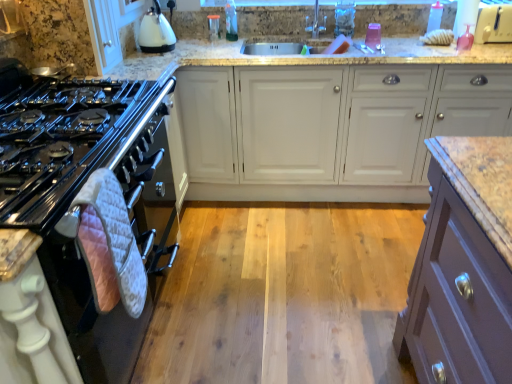
Question: Can you confirm if white quilted oven mitt at left is bigger than white matte cabinet at center?

Choices:
 (A) yes
 (B) no

Answer: (B)

Question: From the image's perspective, is white quilted oven mitt at left under white matte cabinet at center?

Choices:
 (A) no
 (B) yes

Answer: (B)

Question: Is white matte cabinet at center surrounded by white quilted oven mitt at left?

Choices:
 (A) no
 (B) yes

Answer: (A)

Question: Is white quilted oven mitt at left placed right next to white matte cabinet at center?

Choices:
 (A) yes
 (B) no

Answer: (B)

Question: Can we say white quilted oven mitt at left lies outside white matte cabinet at center?

Choices:
 (A) no
 (B) yes

Answer: (B)

Question: Is white quilted oven mitt at left further to the viewer compared to white matte cabinet at center?

Choices:
 (A) no
 (B) yes

Answer: (A)

Question: Considering the relative sizes of transparent plastic bottle at upper right, the first bottle positioned from the right, and black glossy gas stove at left in the image provided, is transparent plastic bottle at upper right, the first bottle positioned from the right, taller than black glossy gas stove at left?

Choices:
 (A) yes
 (B) no

Answer: (A)

Question: Can you confirm if transparent plastic bottle at upper right, the first bottle positioned from the right, is positioned to the right of black glossy gas stove at left?

Choices:
 (A) no
 (B) yes

Answer: (B)

Question: Is transparent plastic bottle at upper right, the first bottle positioned from the right, far from black glossy gas stove at left?

Choices:
 (A) no
 (B) yes

Answer: (B)

Question: Does transparent plastic bottle at upper right, the second bottle in the left-to-right sequence, come in front of black glossy gas stove at left?

Choices:
 (A) no
 (B) yes

Answer: (A)

Question: Is transparent plastic bottle at upper right, the second bottle in the left-to-right sequence, thinner than black glossy gas stove at left?

Choices:
 (A) no
 (B) yes

Answer: (B)

Question: Is transparent plastic bottle at upper right, the second bottle in the left-to-right sequence, further to camera compared to black glossy gas stove at left?

Choices:
 (A) yes
 (B) no

Answer: (A)

Question: Could you tell me if translucent plastic bottle at upper center, which appears as the 2th bottle when viewed from the right, is facing transparent plastic bottle at upper right, the first bottle positioned from the right?

Choices:
 (A) yes
 (B) no

Answer: (B)